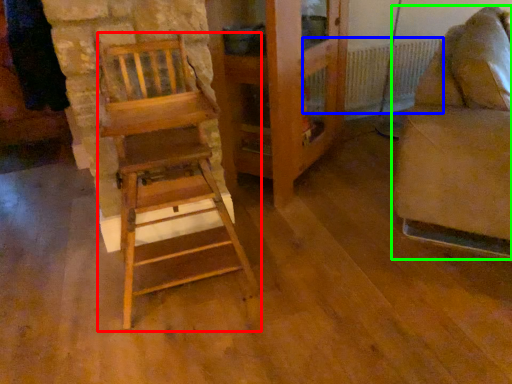
Question: Estimate the real-world distances between objects in this image. Which object is farther from furniture (highlighted by a red box), radiator (highlighted by a blue box) or furniture (highlighted by a green box)?

Choices:
 (A) radiator
 (B) furniture

Answer: (A)